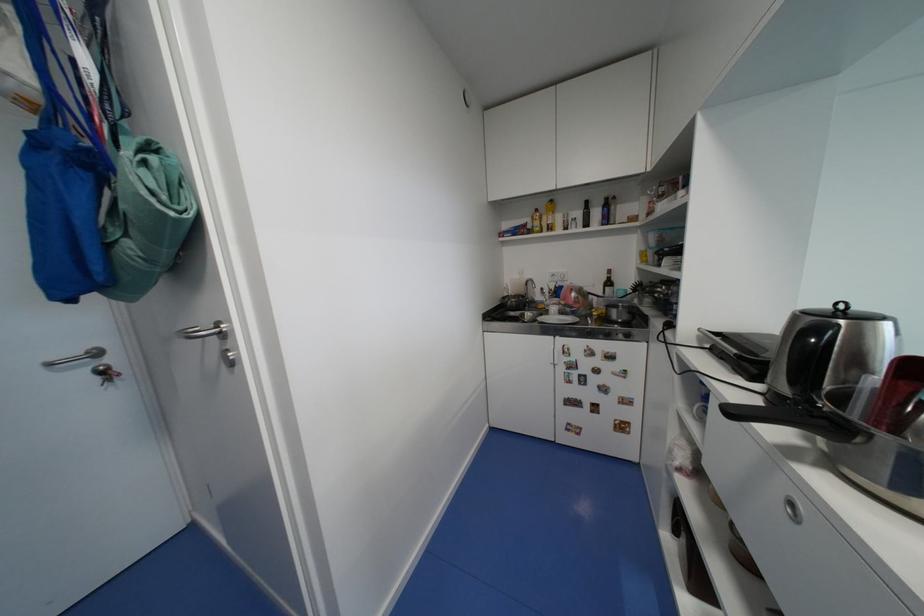
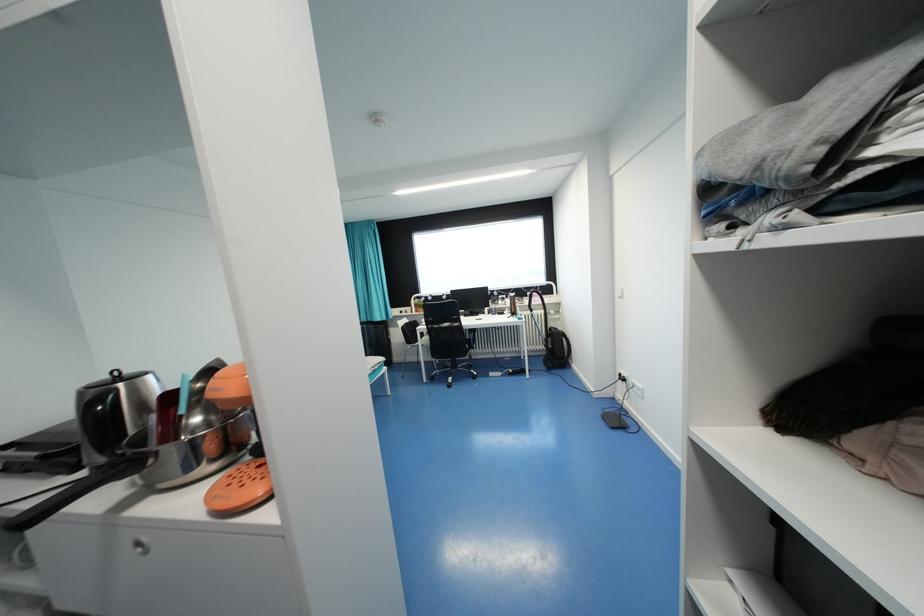
Locate, in the second image, the point that corresponds to (776,346) in the first image.

(79, 429)